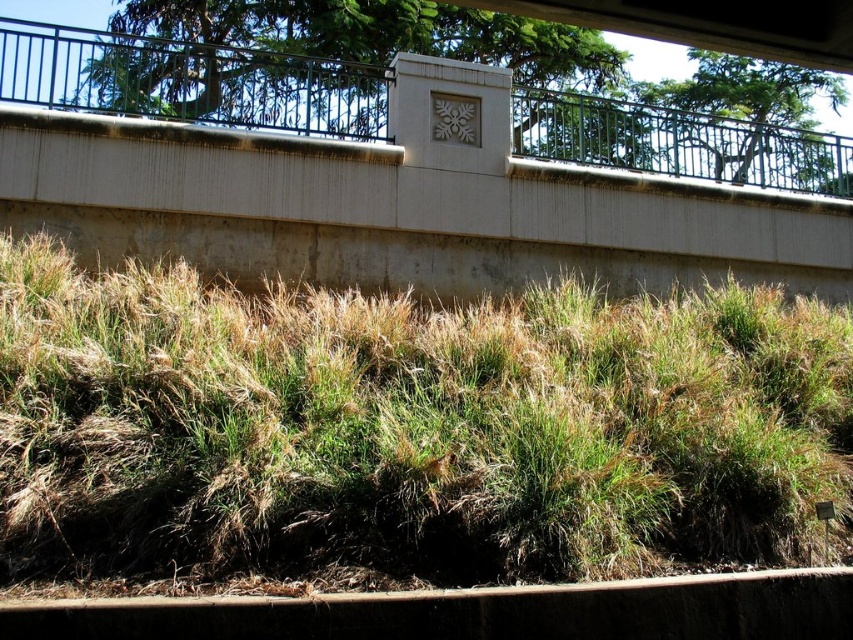
You are standing in front of the wall and want to place a small potted plant between the green grassy at center and the concrete at center. Which area has enough space to accommodate the plant?

The green grassy at center has a larger width than the concrete at center, so it can accommodate the plant better.

You are standing in front of a concrete wall with a decorative metal railing. You notice a green grassy area in the scene. What are the coordinates of the green grassy at center?

The coordinates of the green grassy at center are at point (408, 428).